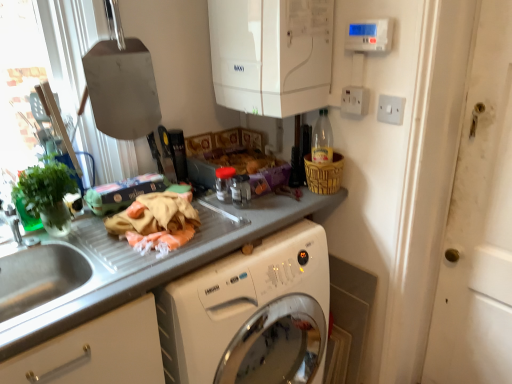
Where is `vacant space situated on the left part of transparent plastic spice jar at center, which is counted as the 2th appliance, starting from the left`? This screenshot has height=384, width=512. vacant space situated on the left part of transparent plastic spice jar at center, which is counted as the 2th appliance, starting from the left is located at coordinates (209, 209).